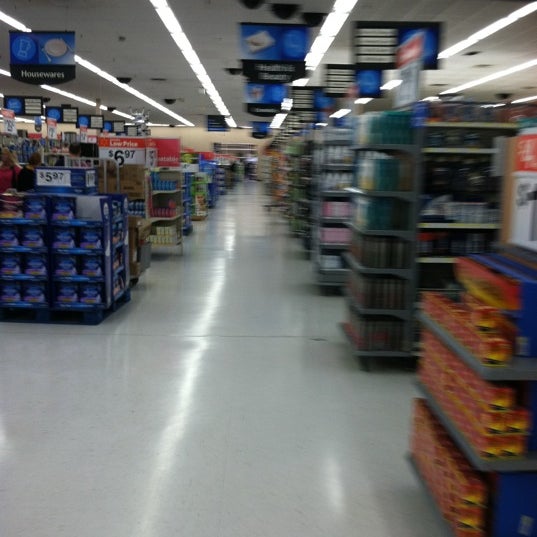
This screenshot has width=537, height=537. Identify the location of poster. (132, 140).